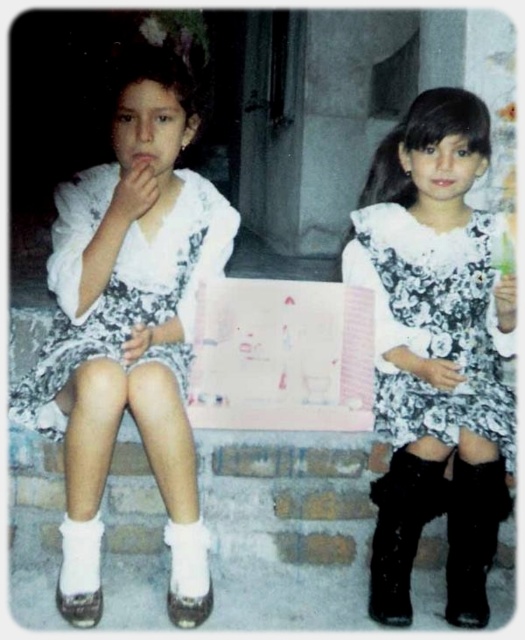
Question: Which point appears closest to the camera in this image?

Choices:
 (A) (85, 577)
 (B) (45, 394)
 (C) (420, 97)

Answer: (A)

Question: Which object appears closest to the camera in this image?

Choices:
 (A) white floral dress at left
 (B) black suede boot at lower right

Answer: (A)

Question: Where is white floral dress at left located in relation to floral dress at center in the image?

Choices:
 (A) left
 (B) right

Answer: (A)

Question: Is white lace dress at left to the left of black suede boot at lower right from the viewer's perspective?

Choices:
 (A) no
 (B) yes

Answer: (B)

Question: Can you confirm if floral-patterned fabric dress at center is thinner than black suede boot at lower right?

Choices:
 (A) yes
 (B) no

Answer: (B)

Question: Estimate the real-world distances between objects in this image. Which object is closer to the floral dress at center?

Choices:
 (A) black suede boot at lower right
 (B) black leather boot at lower right

Answer: (B)